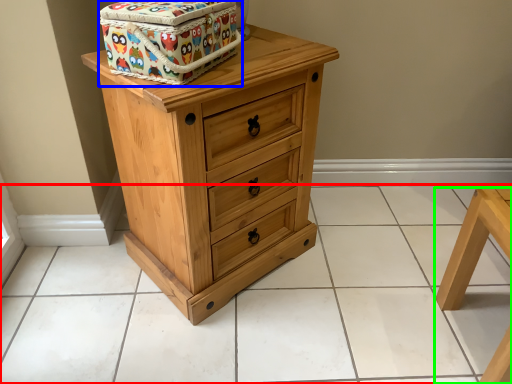
Question: Which object is the farthest from tile (highlighted by a red box)? Choose among these: cardboard box (highlighted by a blue box) or furniture (highlighted by a green box).

Choices:
 (A) cardboard box
 (B) furniture

Answer: (A)